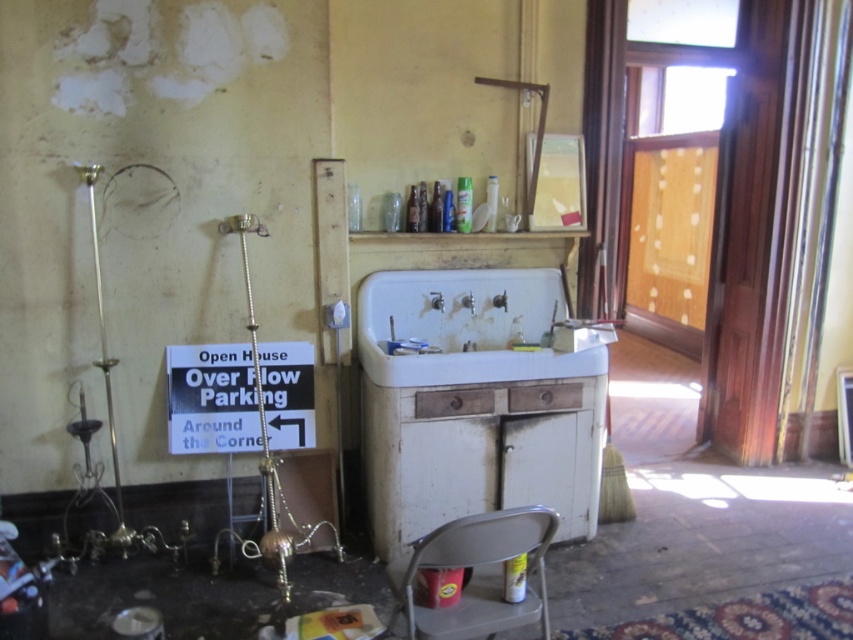
Question: Which point is farther from the camera taking this photo?

Choices:
 (A) (506, 531)
 (B) (196, 438)
 (C) (479, 282)

Answer: (C)

Question: Which of the following is the farthest from the observer?

Choices:
 (A) (468, 321)
 (B) (227, 433)

Answer: (A)

Question: Is white porcelain sink at center smaller than black paper sign at lower left?

Choices:
 (A) no
 (B) yes

Answer: (A)

Question: Can you confirm if white porcelain sink at center is bigger than black paper sign at lower left?

Choices:
 (A) no
 (B) yes

Answer: (B)

Question: Is black paper sign at lower left wider than metallic gray chair at lower center?

Choices:
 (A) no
 (B) yes

Answer: (B)

Question: Which of the following is the closest to the observer?

Choices:
 (A) (207, 426)
 (B) (421, 339)
 (C) (494, 600)

Answer: (C)